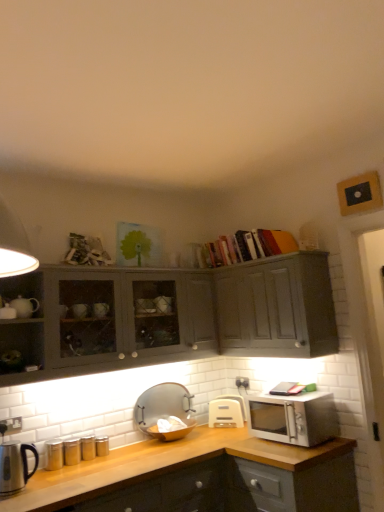
I want to click on white plastic electric outlet at lower left, so click(10, 425).

The width and height of the screenshot is (384, 512). What do you see at coordinates (165, 411) in the screenshot?
I see `transparent glass bowl at center, which is the 2th appliance in left-to-right order` at bounding box center [165, 411].

The width and height of the screenshot is (384, 512). What do you see at coordinates (277, 307) in the screenshot?
I see `matte gray cabinet at upper right, marked as the 2th cabinetry in a left-to-right arrangement` at bounding box center [277, 307].

Locate an element on the screen. Image resolution: width=384 pixels, height=512 pixels. matte gray cabinet at upper left, which is the second cabinetry from right to left is located at coordinates (181, 317).

Which is behind, point (186, 411) or point (12, 420)?

Positioned behind is point (186, 411).

Is transparent glass bowl at center, the second appliance positioned from the back, thinner than white plastic electric outlet at lower left?

In fact, transparent glass bowl at center, the second appliance positioned from the back, might be wider than white plastic electric outlet at lower left.

From the image's perspective, is transparent glass bowl at center, the 2th appliance viewed from the front, beneath white plastic electric outlet at lower left?

Yes.

In order to click on electric outlet above the transparent glass bowl at center, the 2th appliance viewed from the front (from the image's perspective) in this screenshot , I will do `click(10, 425)`.

Which object is more forward, white plastic electric outlet at lower left or matte gray cabinet at upper right, marked as the 2th cabinetry in a left-to-right arrangement?

Positioned in front is white plastic electric outlet at lower left.

You are a GUI agent. You are given a task and a screenshot of the screen. Output one action in this format:
    pyautogui.click(x=<x>, y=<y>)
    Task: Click on the electric outlet on the left of matte gray cabinet at upper right, marked as the 2th cabinetry in a left-to-right arrangement
    
    Given the screenshot: What is the action you would take?
    pos(10,425)

Is the surface of white plastic electric outlet at lower left in direct contact with matte gray cabinet at upper right, marked as the 2th cabinetry in a left-to-right arrangement?

white plastic electric outlet at lower left is not next to matte gray cabinet at upper right, marked as the 2th cabinetry in a left-to-right arrangement, and they're not touching.

Between white plastic electric outlet at lower left and matte gray cabinet at upper right, acting as the first cabinetry starting from the right, which one has larger size?

matte gray cabinet at upper right, acting as the first cabinetry starting from the right.

How many degrees apart are the facing directions of white plastic electric outlet at lower left and transparent glass bowl at center, the second appliance positioned from the back?

There is a 1.15-degree angle between the facing directions of white plastic electric outlet at lower left and transparent glass bowl at center, the second appliance positioned from the back.

Considering the relative sizes of white plastic electric outlet at lower left and transparent glass bowl at center, arranged as the 2th appliance when viewed from the right, in the image provided, is white plastic electric outlet at lower left taller than transparent glass bowl at center, arranged as the 2th appliance when viewed from the right,?

No, white plastic electric outlet at lower left is not taller than transparent glass bowl at center, arranged as the 2th appliance when viewed from the right.

Which is more to the right, white plastic electric outlet at lower left or transparent glass bowl at center, arranged as the 2th appliance when viewed from the right?

From the viewer's perspective, transparent glass bowl at center, arranged as the 2th appliance when viewed from the right, appears more on the right side.

From the image's perspective, is white plastic electric outlet at lower left beneath transparent glass bowl at center, arranged as the 2th appliance when viewed from the right?

Incorrect, from the image's perspective, white plastic electric outlet at lower left is higher than transparent glass bowl at center, arranged as the 2th appliance when viewed from the right.

Considering the relative sizes of white plastic toaster at center, which is the first appliance from back to front, and white plastic electric outlet at lower left in the image provided, is white plastic toaster at center, which is the first appliance from back to front, wider than white plastic electric outlet at lower left?

Yes.

Could you tell me if white plastic toaster at center, which is the first appliance from back to front, is turned towards white plastic electric outlet at lower left?

No, white plastic toaster at center, which is the first appliance from back to front, is not turned towards white plastic electric outlet at lower left.

Considering their positions, is matte gray cabinet at upper right, marked as the 2th cabinetry in a left-to-right arrangement, located in front of or behind matte gray cabinet at upper left, which is the second cabinetry from right to left?

In the image, matte gray cabinet at upper right, marked as the 2th cabinetry in a left-to-right arrangement, appears behind matte gray cabinet at upper left, which is the second cabinetry from right to left.

Considering the positions of point (268, 288) and point (83, 366), is point (268, 288) closer or farther from the camera than point (83, 366)?

Point (268, 288) is positioned farther from the camera compared to point (83, 366).

From a real-world perspective, which object stands above the other?

From a 3D spatial view, matte gray cabinet at upper left, which is the second cabinetry from right to left, is above.

Is matte gray cabinet at upper right, acting as the first cabinetry starting from the right, wider than matte gray cabinet at upper left, which is the second cabinetry from right to left?

No, matte gray cabinet at upper right, acting as the first cabinetry starting from the right, is not wider than matte gray cabinet at upper left, which is the second cabinetry from right to left.

Can you confirm if white plastic toaster at center, which is the first appliance from back to front, is shorter than matte gray cabinet at upper right, acting as the first cabinetry starting from the right?

Yes, white plastic toaster at center, which is the first appliance from back to front, is shorter than matte gray cabinet at upper right, acting as the first cabinetry starting from the right.

Are white plastic toaster at center, the 1th appliance when ordered from right to left, and matte gray cabinet at upper right, acting as the first cabinetry starting from the right, making contact?

No, white plastic toaster at center, the 1th appliance when ordered from right to left, is not making contact with matte gray cabinet at upper right, acting as the first cabinetry starting from the right.

From the image's perspective, is white plastic toaster at center, the 1th appliance when ordered from right to left, under matte gray cabinet at upper right, marked as the 2th cabinetry in a left-to-right arrangement?

Correct, white plastic toaster at center, the 1th appliance when ordered from right to left, appears lower than matte gray cabinet at upper right, marked as the 2th cabinetry in a left-to-right arrangement, in the image.

Is white plastic toaster at center, which is the 3th appliance from left to right, positioned behind matte gray cabinet at upper right, acting as the first cabinetry starting from the right?

Yes, white plastic toaster at center, which is the 3th appliance from left to right, is further from the viewer.

Does transparent glass bowl at center, the 2th appliance viewed from the front, appear on the right side of satin silver microwave at right?

No.

Does transparent glass bowl at center, which is the 2th appliance in left-to-right order, turn towards satin silver microwave at right?

Yes, transparent glass bowl at center, which is the 2th appliance in left-to-right order, faces towards satin silver microwave at right.

From the image's perspective, would you say transparent glass bowl at center, which is the 2th appliance in left-to-right order, is shown under satin silver microwave at right?

Yes, from the image's perspective, transparent glass bowl at center, which is the 2th appliance in left-to-right order, is beneath satin silver microwave at right.

Locate an element on the screen. This screenshot has width=384, height=512. the 2nd appliance to the right of the white plastic electric outlet at lower left, starting your count from the anchor is located at coordinates (165, 411).

Locate an element on the screen. The height and width of the screenshot is (512, 384). electric outlet directly beneath the matte gray cabinet at upper right, acting as the first cabinetry starting from the right (from a real-world perspective) is located at coordinates (10, 425).

Looking at the image, which one is located further to stainless steel kettle at left, the third appliance from the back, transparent glass bowl at center, the second appliance positioned from the back, or satin silver microwave at right?

Among the two, satin silver microwave at right is located further to stainless steel kettle at left, the third appliance from the back.

When comparing their distances from matte gray cabinet at upper left, which is the second cabinetry from right to left, does transparent glass bowl at center, the 2th appliance viewed from the front, or stainless steel kettle at left, the third appliance from the back, seem further?

stainless steel kettle at left, the third appliance from the back.

Which object lies further to the anchor point matte gray cabinet at upper left, which is the second cabinetry from right to left, white plastic electric outlet at lower left or transparent glass bowl at center, which is the 2th appliance in left-to-right order?

white plastic electric outlet at lower left lies further to matte gray cabinet at upper left, which is the second cabinetry from right to left, than the other object.

Looking at the image, which one is located further to white plastic electric outlet at lower left, matte gray cabinet at upper left, the 1th cabinetry when ordered from left to right, or white plastic toaster at center, the 1th appliance when ordered from right to left?

white plastic toaster at center, the 1th appliance when ordered from right to left, is positioned further to the anchor white plastic electric outlet at lower left.

Based on the photo, when comparing their distances from transparent glass bowl at center, which is the 2th appliance in left-to-right order, does matte gray cabinet at upper right, acting as the first cabinetry starting from the right, or satin silver microwave at right seem closer?

satin silver microwave at right is closer to transparent glass bowl at center, which is the 2th appliance in left-to-right order.

Based on their spatial positions, is matte gray cabinet at upper right, marked as the 2th cabinetry in a left-to-right arrangement, or transparent glass bowl at center, the second appliance positioned from the back, further from white plastic toaster at center, the 1th appliance when ordered from right to left?

matte gray cabinet at upper right, marked as the 2th cabinetry in a left-to-right arrangement, is further to white plastic toaster at center, the 1th appliance when ordered from right to left.

Which object lies further to the anchor point matte gray cabinet at upper right, marked as the 2th cabinetry in a left-to-right arrangement, stainless steel kettle at left, which is the 1th appliance from front to back, or matte gray cabinet at upper left, the 1th cabinetry when ordered from left to right?

Among the two, stainless steel kettle at left, which is the 1th appliance from front to back, is located further to matte gray cabinet at upper right, marked as the 2th cabinetry in a left-to-right arrangement.

Looking at the image, which one is located further to matte gray cabinet at upper left, the 1th cabinetry when ordered from left to right, white plastic electric outlet at lower left or satin silver microwave at right?

white plastic electric outlet at lower left.

At what (x,y) coordinates should I click in order to perform the action: click on microwave oven between matte gray cabinet at upper right, acting as the first cabinetry starting from the right, and white plastic toaster at center, the 1th appliance when ordered from right to left, vertically. Please return your answer as a coordinate pair (x, y). This screenshot has height=512, width=384. Looking at the image, I should click on (293, 418).

You are a GUI agent. You are given a task and a screenshot of the screen. Output one action in this format:
    pyautogui.click(x=<x>, y=<y>)
    Task: Click on the cabinetry between white plastic electric outlet at lower left and matte gray cabinet at upper right, acting as the first cabinetry starting from the right, from left to right
    
    Given the screenshot: What is the action you would take?
    pyautogui.click(x=181, y=317)

Where is `cabinetry located between stainless steel kettle at left, the 1th appliance positioned from the left, and white plastic toaster at center, which is the first appliance from back to front, in the left-right direction`? The height and width of the screenshot is (512, 384). cabinetry located between stainless steel kettle at left, the 1th appliance positioned from the left, and white plastic toaster at center, which is the first appliance from back to front, in the left-right direction is located at coordinates (181, 317).

The height and width of the screenshot is (512, 384). I want to click on cabinetry located between transparent glass bowl at center, the second appliance positioned from the back, and satin silver microwave at right in the left-right direction, so click(x=277, y=307).